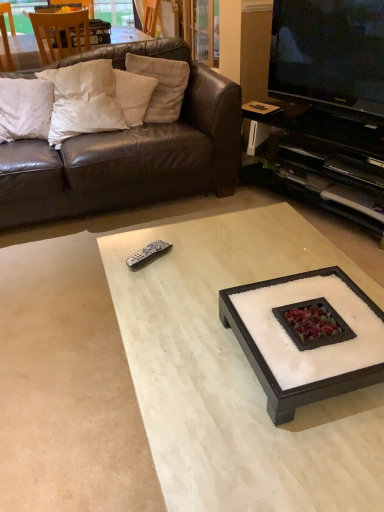
Locate an element on the screen. vacant point above white marble coffee table at center, positioned as the 2th coffee table in top-to-bottom order (from a real-world perspective) is located at coordinates tap(217, 301).